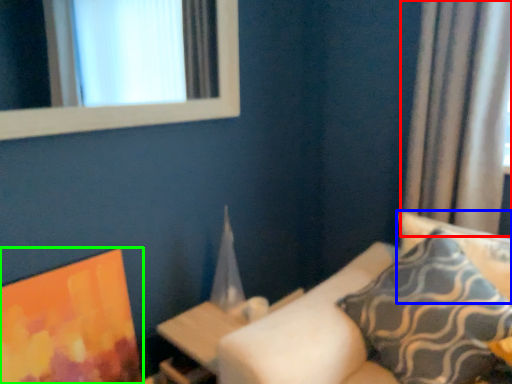
Question: Which object is the farthest from curtain (highlighted by a red box)? Choose among these: pillow (highlighted by a blue box) or picture frame (highlighted by a green box).

Choices:
 (A) pillow
 (B) picture frame

Answer: (B)